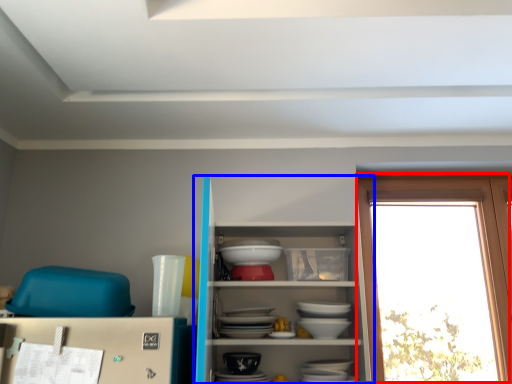
Question: Among these objects, which one is farthest to the camera, window (highlighted by a red box) or shelf (highlighted by a blue box)?

Choices:
 (A) window
 (B) shelf

Answer: (A)